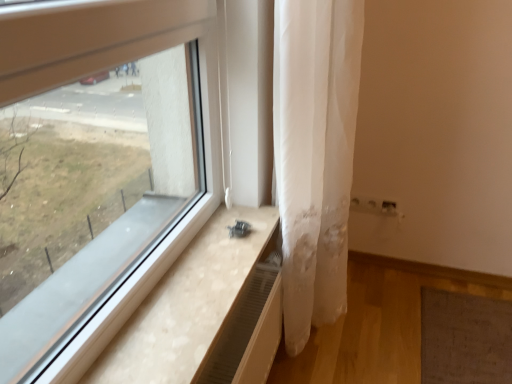
Where is `vacant space situated above light wood/texture window sill at lower left (from a real-world perspective)`? This screenshot has height=384, width=512. vacant space situated above light wood/texture window sill at lower left (from a real-world perspective) is located at coordinates (200, 271).